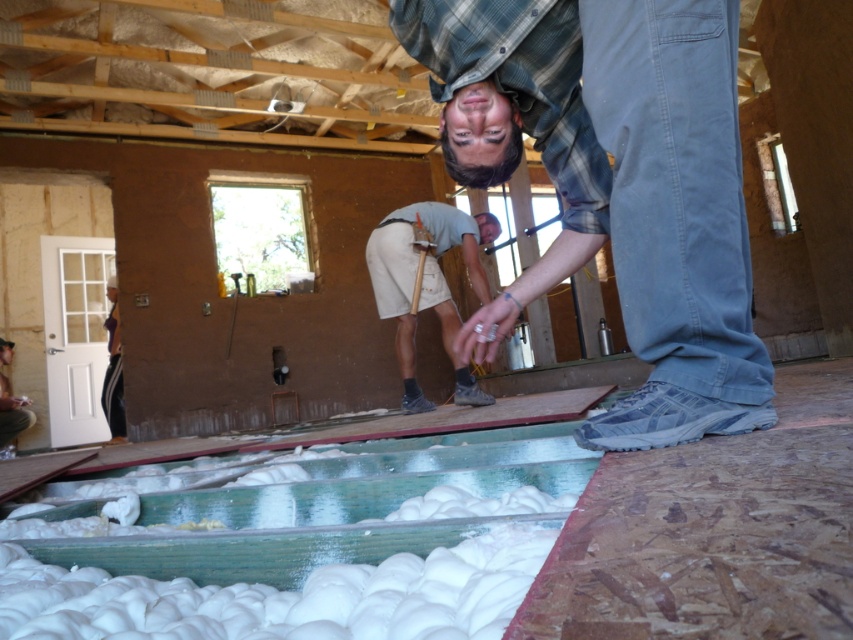
You are a construction worker standing at the point labeled as point [614,184]. What clothing item is located at your current position?

The blue jeans at center are located at point [614,184].